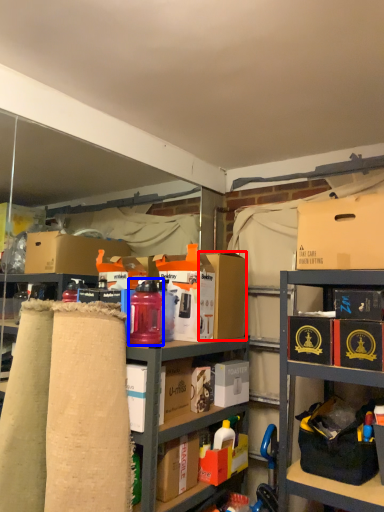
Question: Which point is closer to the camera, cardboard box (highlighted by a red box) or bottle (highlighted by a blue box)?

Choices:
 (A) cardboard box
 (B) bottle

Answer: (B)